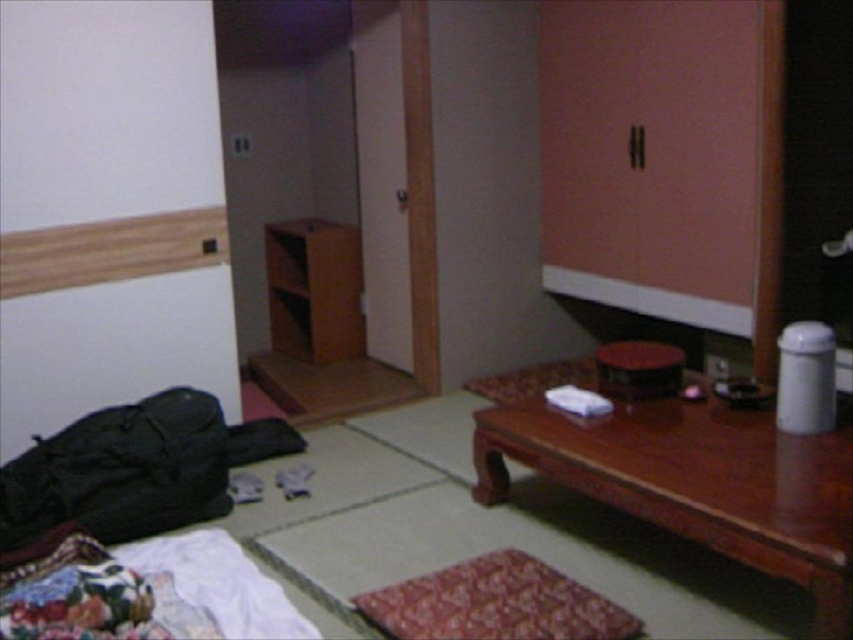
Which is more to the right, brown wooden table at lower right or brown wood cabinet at center?

From the viewer's perspective, brown wooden table at lower right appears more on the right side.

Which is below, brown wooden table at lower right or brown wood cabinet at center?

brown wooden table at lower right is below.

Is point (849, 429) positioned after point (338, 289)?

No.

At what (x,y) coordinates should I click in order to perform the action: click on brown wooden table at lower right. Please return your answer as a coordinate pair (x, y). Looking at the image, I should click on (695, 483).

Is brown wooden table at lower right further to camera compared to wooden stool at center?

No.

Is brown wooden table at lower right to the right of wooden stool at center from the viewer's perspective?

Indeed, brown wooden table at lower right is positioned on the right side of wooden stool at center.

This screenshot has width=853, height=640. Identify the location of brown wooden table at lower right. (695, 483).

Can you confirm if brown wood cabinet at center is positioned to the left of wooden stool at center?

Indeed, brown wood cabinet at center is positioned on the left side of wooden stool at center.

Does point (300, 268) come farther from viewer compared to point (641, 346)?

Yes.

Where is `brown wood cabinet at center`? The height and width of the screenshot is (640, 853). brown wood cabinet at center is located at coordinates (314, 289).